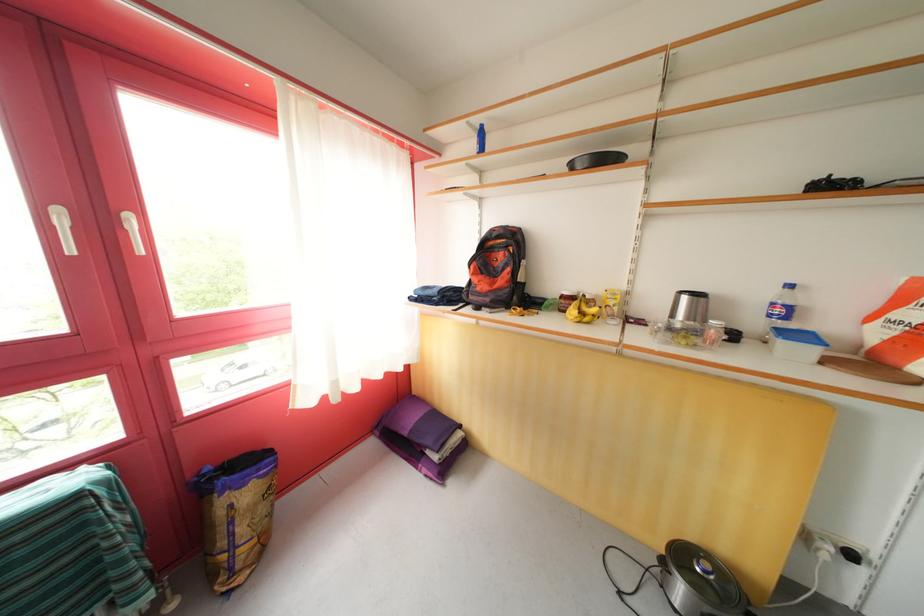
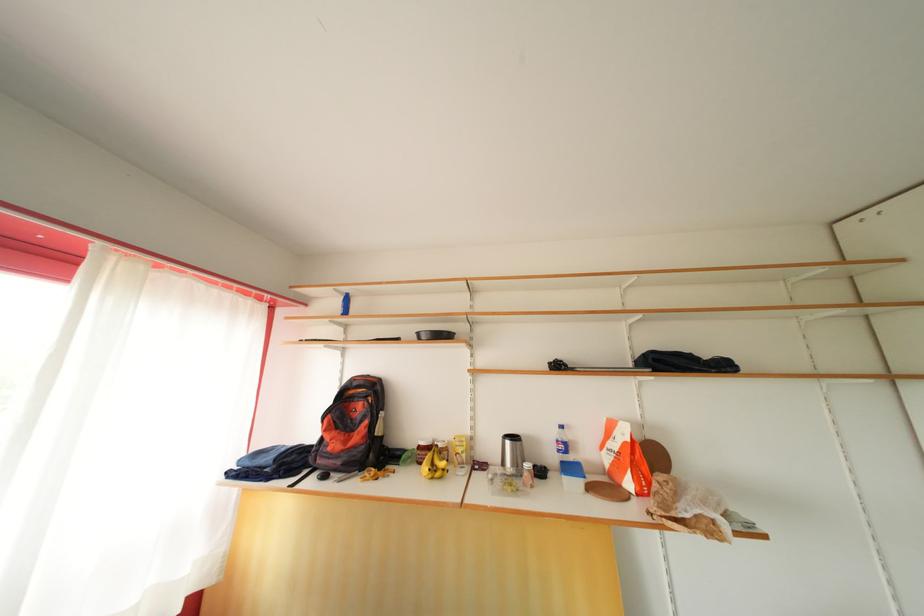
Locate, in the second image, the point that corresponds to (x=761, y=328) in the first image.

(558, 463)